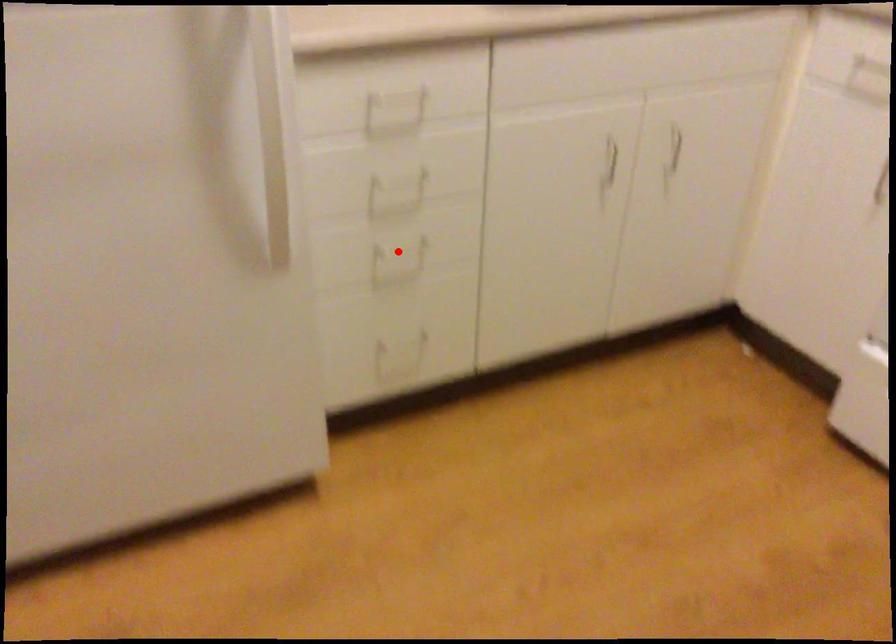
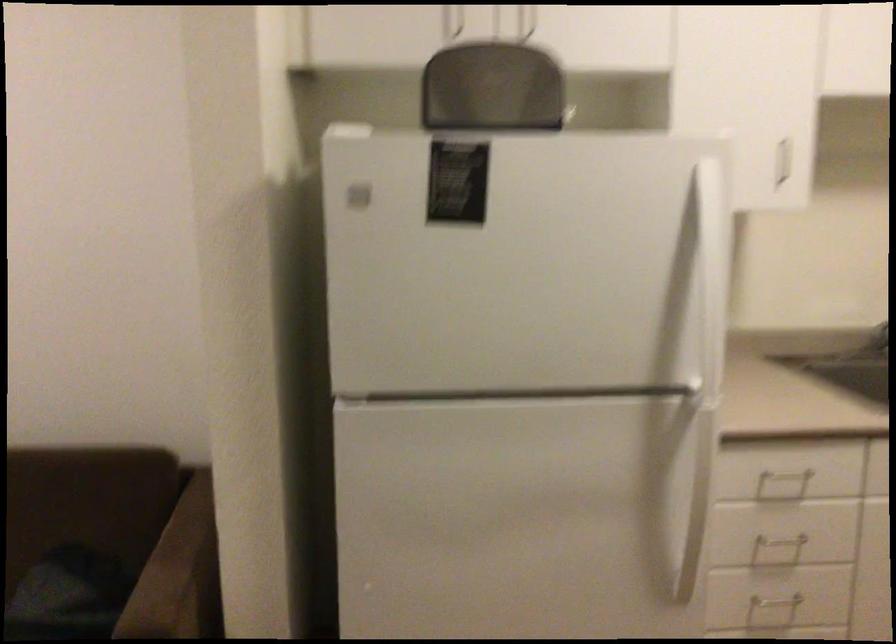
Question: I am providing you with two images of the same scene from different viewpoints. In image1, a red point is highlighted. Considering the same 3D point in image2, which of the following is correct?

Choices:
 (A) It is closer
 (B) It is farther

Answer: (B)